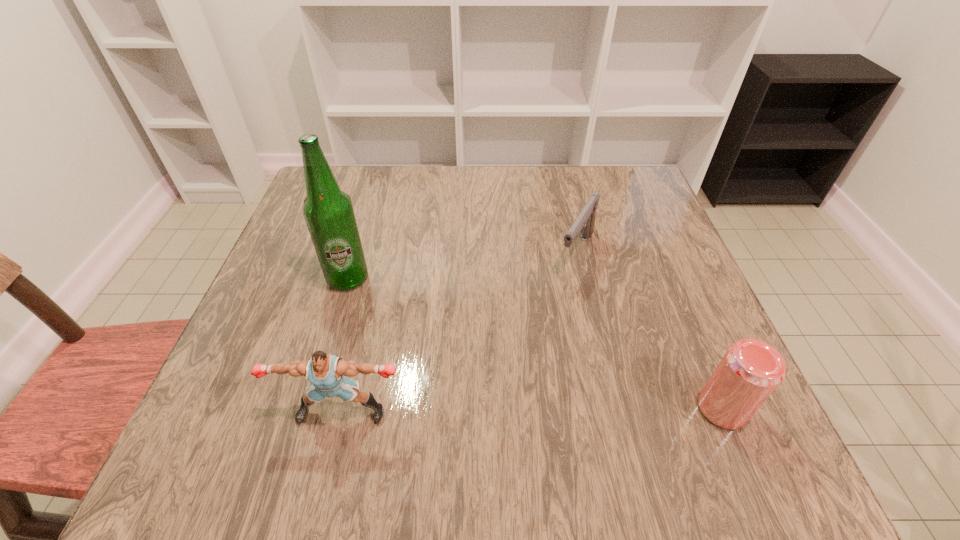
Identify the location of vacant space at the near edge of the desktop. Image resolution: width=960 pixels, height=540 pixels. (560, 411).

Find the location of a particular element. free space at the left edge of the desktop is located at coordinates (260, 312).

Where is `vacant position at the right edge of the desktop`? The width and height of the screenshot is (960, 540). vacant position at the right edge of the desktop is located at coordinates (646, 231).

This screenshot has height=540, width=960. Find the location of `vacant region at the far left corner of the desktop`. vacant region at the far left corner of the desktop is located at coordinates (345, 166).

Identify the location of vacant space at the far right corner. The width and height of the screenshot is (960, 540). (617, 202).

In the image, there is a desktop. Identify the location of blank space at the near right corner. Image resolution: width=960 pixels, height=540 pixels. (690, 417).

The height and width of the screenshot is (540, 960). Find the location of `vacant space in between the puncher and the rightmost object`. vacant space in between the puncher and the rightmost object is located at coordinates (532, 410).

The width and height of the screenshot is (960, 540). Identify the location of blank region between the rightmost object and the puncher. (532, 410).

I want to click on vacant space in between the pistol and the beer can, so [x=649, y=330].

The image size is (960, 540). I want to click on blank region between the pistol and the rightmost object, so click(x=649, y=330).